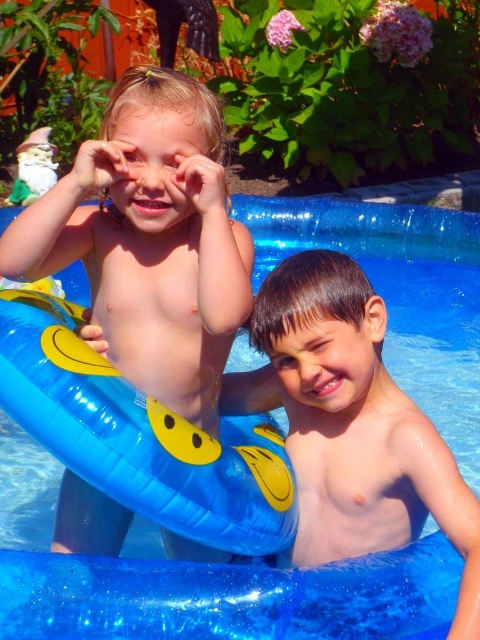
You are standing in front of the inflatable pool and want to reach the matte yellow float at left. The pool is 3 feet deep. Can you safely step into the pool to retrieve it?

The matte yellow float at left is 5.07 feet away from you. Since the pool is only 3 feet deep, stepping into it would be safe as the water depth is sufficient for reaching the float without drowning risk.

You are a parent supervising the children in the inflatable pool. You notice the matte yellow float at left and the smooth skin boy at center. Which object takes up more area in the pool?

The smooth skin boy at center occupies more area in the pool than the matte yellow float at left.